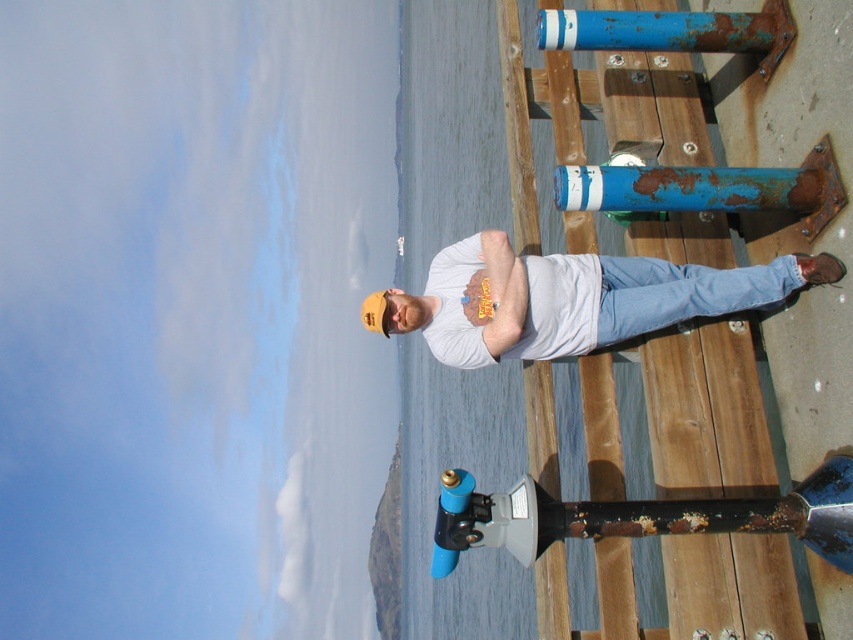
You are a person who is 1.8 meters tall. You are standing on the wooden pier and want to reach the blue matte pipe at lower center from the white cotton shirt at center. Can you do it without bending down?

The white cotton shirt at center is 1.99 meters from the blue matte pipe at lower center. Since you are 1.8 meters tall, you can reach up to approximately 2.16 meters. The distance between them is within your reach, so you can reach the blue matte pipe at lower center without bending down.

You are a photographer positioned at the end of the pier. You want to take a photo of the white cotton shirt at center and the blue matte pipe at lower center. Which object will appear closer to the camera in the photo?

The white cotton shirt at center will appear closer to the camera in the photo because it is further to the viewer than the blue matte pipe at lower center.